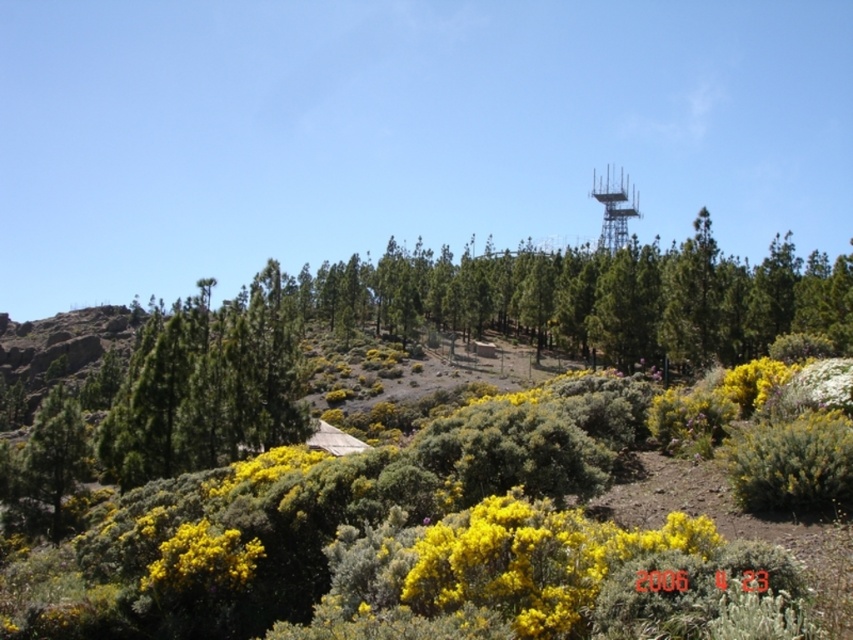
Question: Can you confirm if yellow matte flower at center is smaller than yellow fluffy bush at lower left?

Choices:
 (A) yes
 (B) no

Answer: (A)

Question: In this image, where is yellow matte flower at center located relative to yellow fluffy bush at lower left?

Choices:
 (A) right
 (B) left

Answer: (A)

Question: Which point appears closest to the camera in this image?

Choices:
 (A) (175, 577)
 (B) (496, 516)

Answer: (B)

Question: Can you confirm if yellow matte flower at center is thinner than yellow fluffy bush at lower left?

Choices:
 (A) no
 (B) yes

Answer: (B)